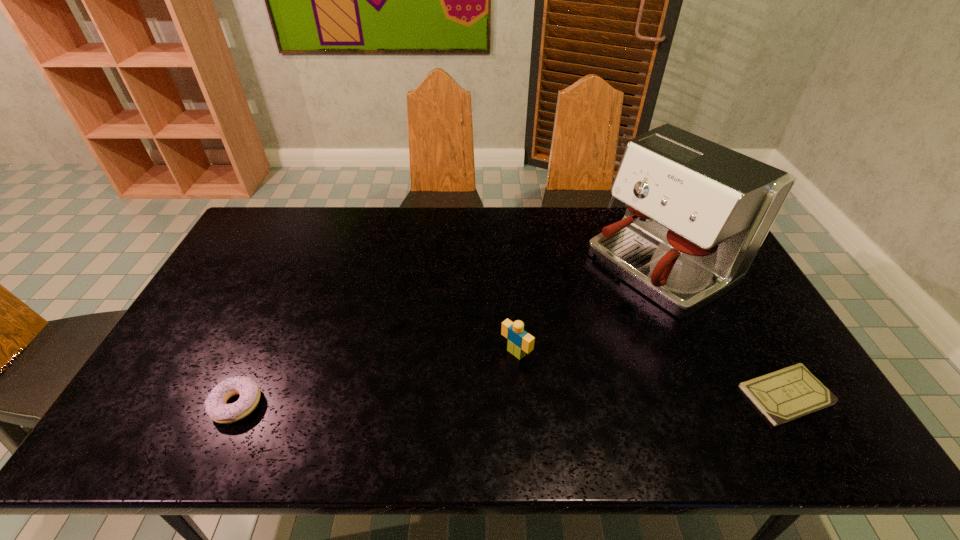
Locate an element on the screen. free space located on the face of the Lego is located at coordinates (473, 390).

This screenshot has height=540, width=960. I want to click on vacant space located 0.090m on the face of the Lego, so click(482, 382).

This screenshot has width=960, height=540. What are the coordinates of `vacant space located 0.380m on the front of the farthest object near the spout` in the screenshot? It's located at (513, 355).

Where is `free space located on the front of the farthest object near the spout`? This screenshot has width=960, height=540. free space located on the front of the farthest object near the spout is located at coordinates (598, 303).

Where is `vacant space positioned on the front of the farthest object near the spout`? Image resolution: width=960 pixels, height=540 pixels. vacant space positioned on the front of the farthest object near the spout is located at coordinates (510, 357).

At what (x,y) coordinates should I click in order to perform the action: click on object situated at the far edge. Please return your answer as a coordinate pair (x, y). This screenshot has width=960, height=540. Looking at the image, I should click on (697, 213).

The height and width of the screenshot is (540, 960). What are the coordinates of `doughnut that is positioned at the near edge` in the screenshot? It's located at (215, 405).

Identify the location of checkbook situated at the near edge. The image size is (960, 540). (782, 396).

Where is `checkbook at the right edge`? checkbook at the right edge is located at coordinates (782, 396).

What are the coordinates of `coffee maker that is at the right edge` in the screenshot? It's located at (697, 213).